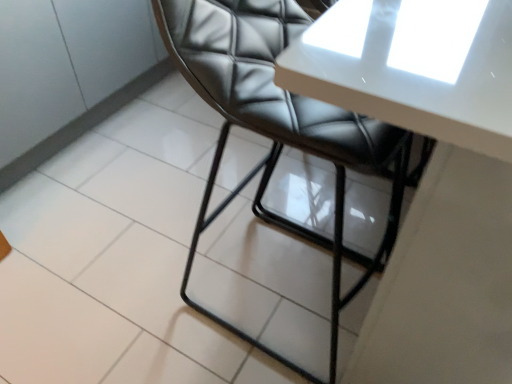
Question: Can white glossy table at upper center be found inside black leather chair at center?

Choices:
 (A) yes
 (B) no

Answer: (B)

Question: Is black leather chair at center positioned beyond the bounds of white glossy table at upper center?

Choices:
 (A) no
 (B) yes

Answer: (A)

Question: Does black leather chair at center have a greater height compared to white glossy table at upper center?

Choices:
 (A) no
 (B) yes

Answer: (B)

Question: From a real-world perspective, is black leather chair at center physically below white glossy table at upper center?

Choices:
 (A) yes
 (B) no

Answer: (B)

Question: Could you tell me if black leather chair at center is facing white glossy table at upper center?

Choices:
 (A) no
 (B) yes

Answer: (B)

Question: Can you confirm if black leather chair at center is positioned to the left of white glossy table at upper center?

Choices:
 (A) yes
 (B) no

Answer: (A)

Question: Considering the relative sizes of white glossy table at upper center and black leather chair at center in the image provided, is white glossy table at upper center shorter than black leather chair at center?

Choices:
 (A) no
 (B) yes

Answer: (B)

Question: Is black leather chair at center located within white glossy table at upper center?

Choices:
 (A) no
 (B) yes

Answer: (B)

Question: Is white glossy table at upper center bigger than black leather chair at center?

Choices:
 (A) yes
 (B) no

Answer: (A)

Question: Are white glossy table at upper center and black leather chair at center far apart?

Choices:
 (A) yes
 (B) no

Answer: (B)

Question: From the image's perspective, does white glossy table at upper center appear lower than black leather chair at center?

Choices:
 (A) yes
 (B) no

Answer: (B)

Question: Is white glossy table at upper center oriented towards black leather chair at center?

Choices:
 (A) no
 (B) yes

Answer: (A)

Question: Considering their positions, is black leather chair at center located in front of or behind white glossy table at upper center?

Choices:
 (A) behind
 (B) front

Answer: (A)